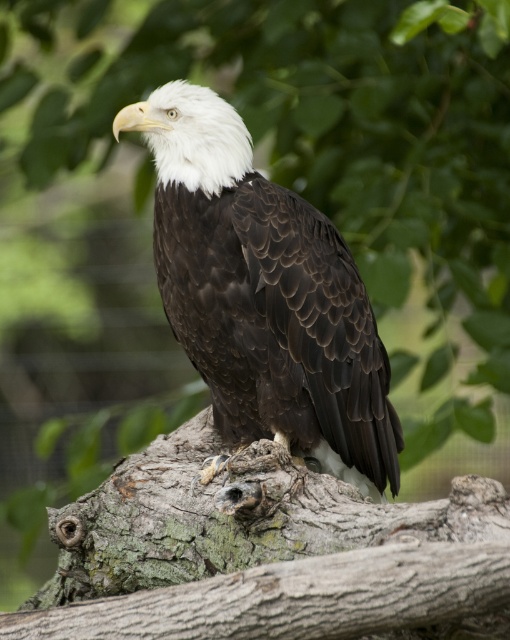
Question: Is rough bark tree trunk at center thinner than dark brown feathers at center?

Choices:
 (A) no
 (B) yes

Answer: (A)

Question: Which of the following is the farthest from the observer?

Choices:
 (A) (148, 620)
 (B) (256, 330)

Answer: (B)

Question: Can you confirm if rough bark tree trunk at center is bigger than dark brown feathers at center?

Choices:
 (A) no
 (B) yes

Answer: (B)

Question: Does rough bark tree trunk at center appear under dark brown feathers at center?

Choices:
 (A) no
 (B) yes

Answer: (B)